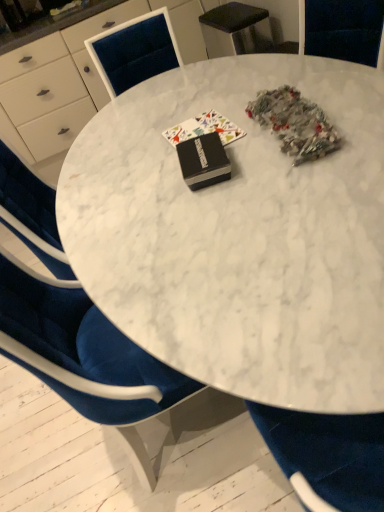
This screenshot has width=384, height=512. In order to click on vacant area on the back side of black matte book at center, which ranks as the second book in back-to-front order in this screenshot , I will do `click(186, 133)`.